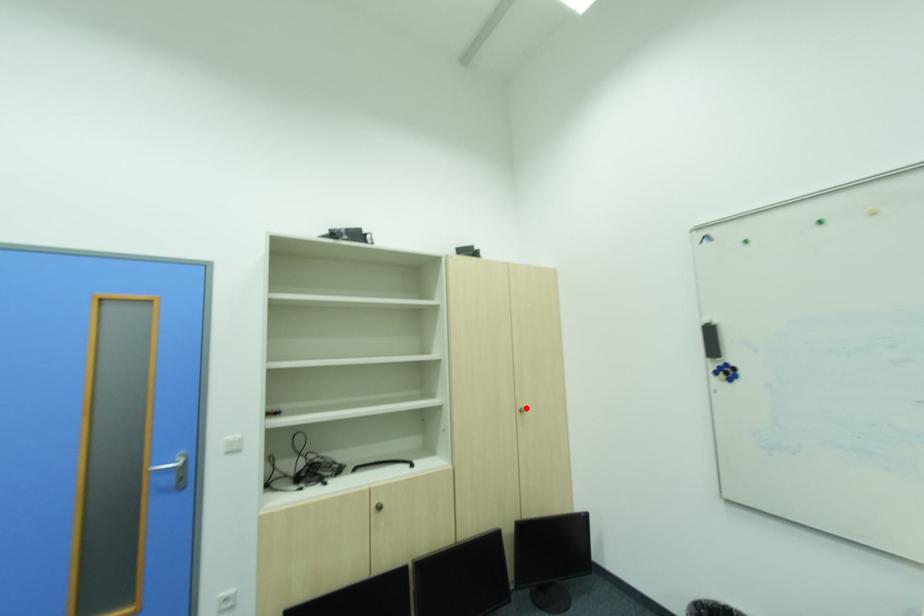
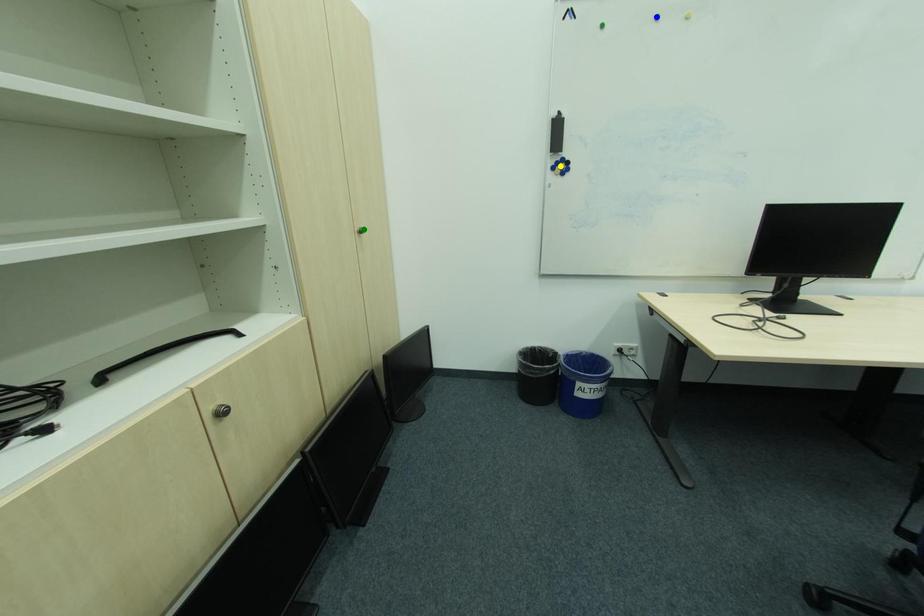
Question: I am providing you with two images of the same scene from different viewpoints. A red point is marked on the first image. You are given multiple points on the second image. Which spot in image 2 lines up with the point in image 1?

Choices:
 (A) blue point
 (B) green point
 (C) yellow point

Answer: (B)